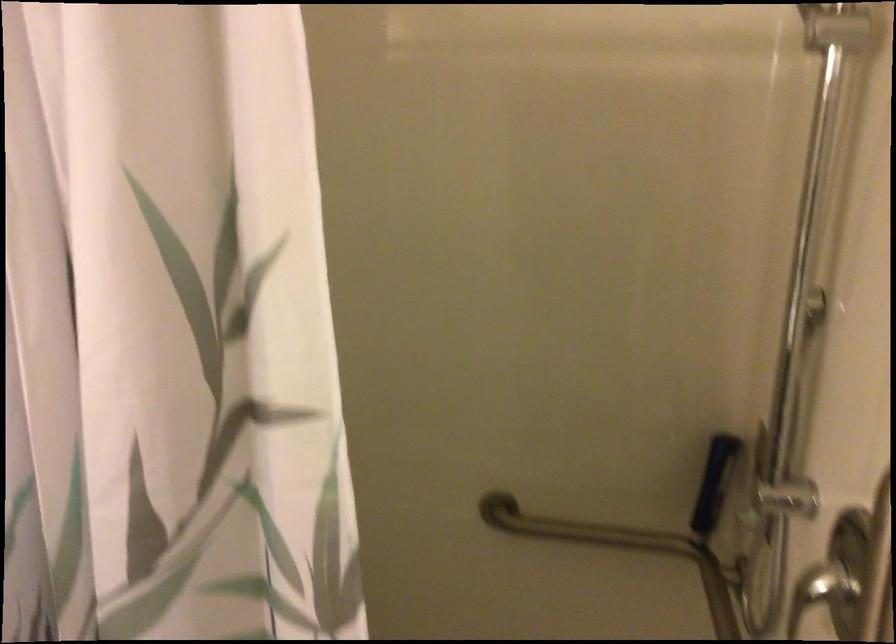
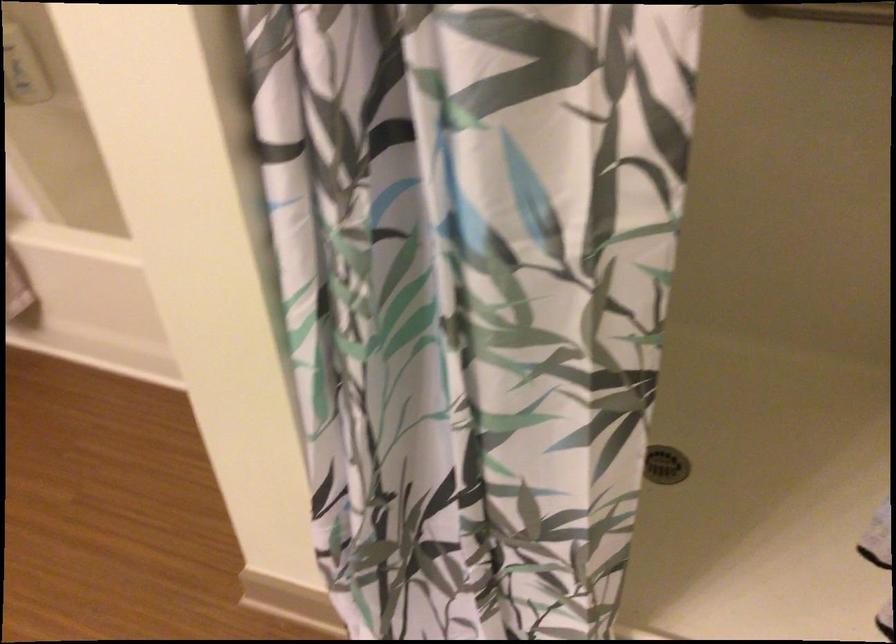
Question: The images are taken continuously from a first-person perspective. In which direction is your viewpoint rotating?

Choices:
 (A) Left
 (B) Right
 (C) Up
 (D) Down

Answer: (D)